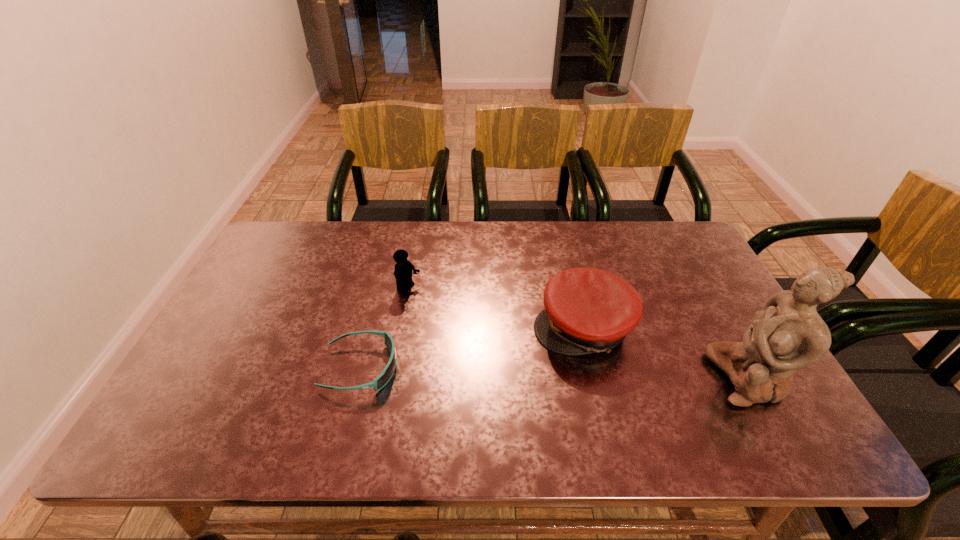
Where is `free space at the near edge of the desktop`? The width and height of the screenshot is (960, 540). free space at the near edge of the desktop is located at coordinates (715, 398).

Where is `free space at the left edge`? The image size is (960, 540). free space at the left edge is located at coordinates (267, 335).

Identify the location of vacant space at the near left corner of the desktop. This screenshot has height=540, width=960. (227, 386).

Locate an element on the screen. The height and width of the screenshot is (540, 960). vacant space at the far right corner of the desktop is located at coordinates (667, 243).

Identify the location of free space between the cap and the Lego. (496, 308).

Identify the location of blank region between the sunglasses and the figurine. (555, 373).

Identify the location of free space between the cap and the rightmost object. Image resolution: width=960 pixels, height=540 pixels. (666, 353).

Where is `empty space that is in between the sunglasses and the cap`? empty space that is in between the sunglasses and the cap is located at coordinates (471, 348).

This screenshot has height=540, width=960. What are the coordinates of `free space between the cap and the sunglasses` in the screenshot? It's located at (471, 348).

Find the location of a particular element. vacant area that lies between the cap and the rightmost object is located at coordinates (666, 353).